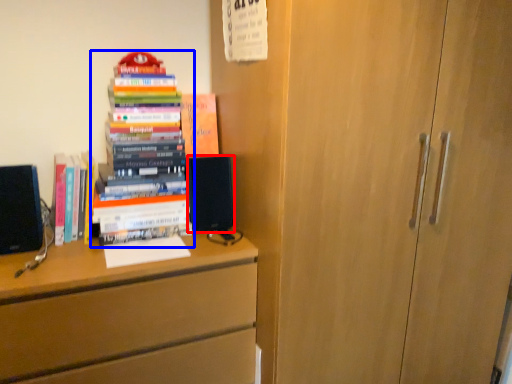
Question: Among these objects, which one is farthest to the camera, speaker (highlighted by a red box) or book (highlighted by a blue box)?

Choices:
 (A) speaker
 (B) book

Answer: (A)